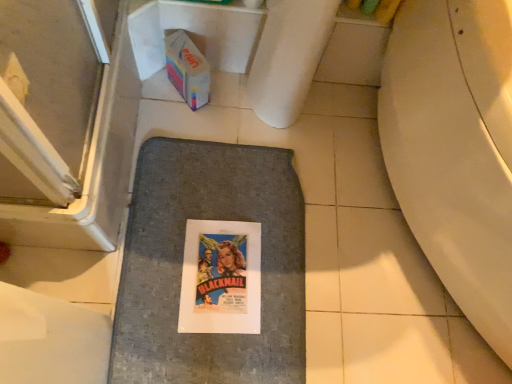
I want to click on vacant area located to the right-hand side of multicolored cardboard box at upper left, so [x=233, y=117].